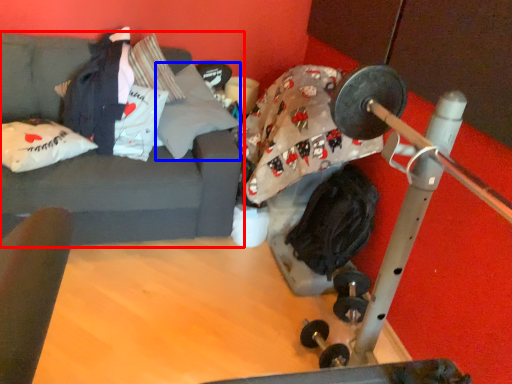
Question: Which of the following is the farthest to the observer, studio couch (highlighted by a red box) or pillow (highlighted by a blue box)?

Choices:
 (A) studio couch
 (B) pillow

Answer: (B)